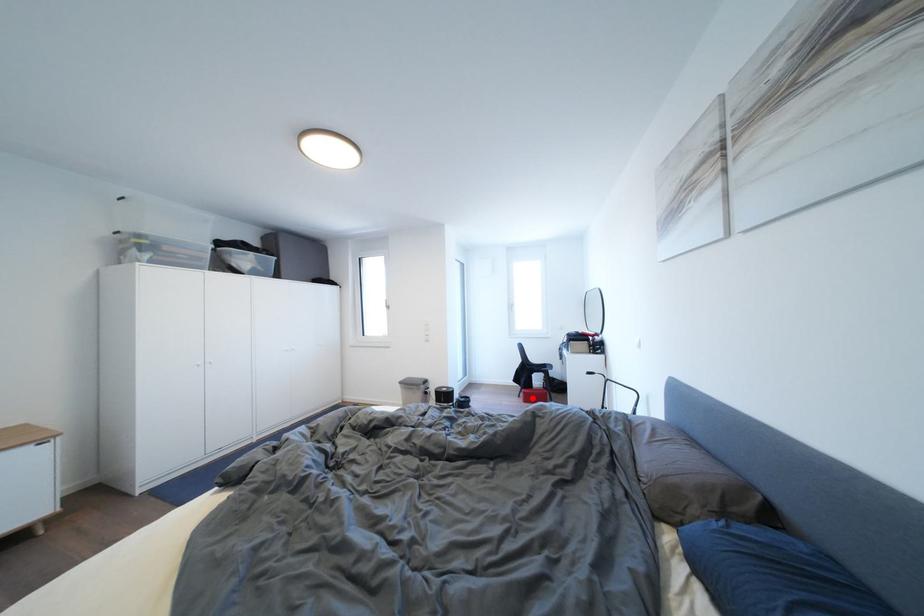
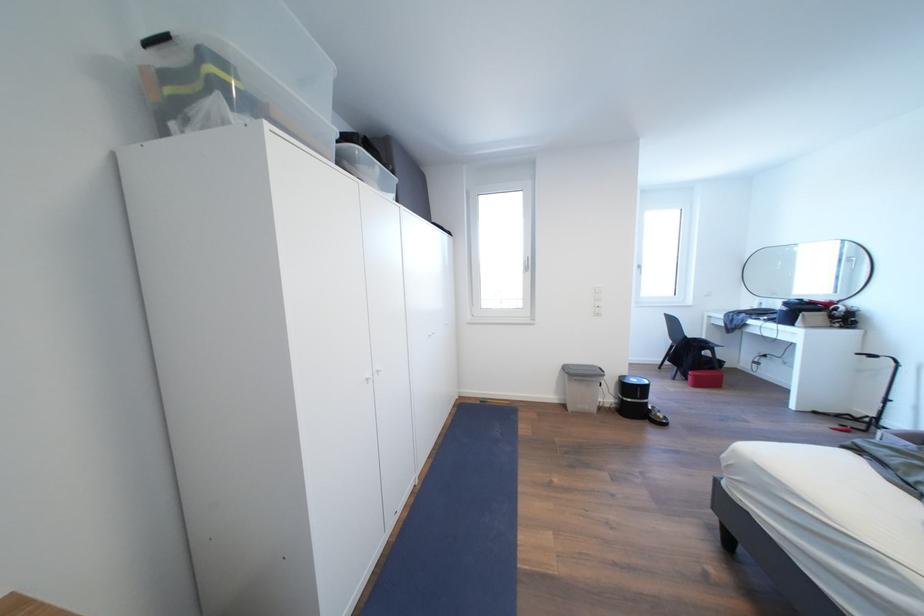
Where in the second image is the point corresponding to the highlighted location from the first image?

(703, 381)